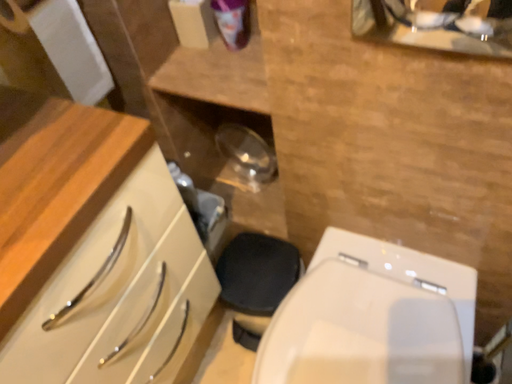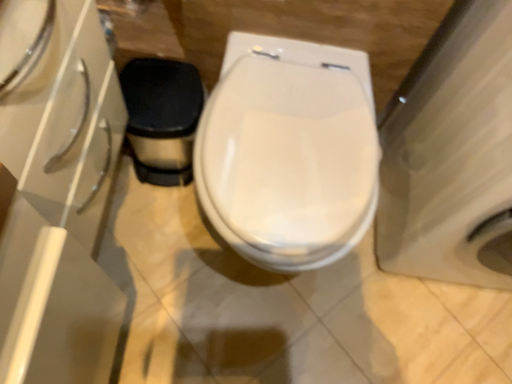
Question: How did the camera likely rotate when shooting the video?

Choices:
 (A) rotated downward
 (B) rotated upward

Answer: (A)